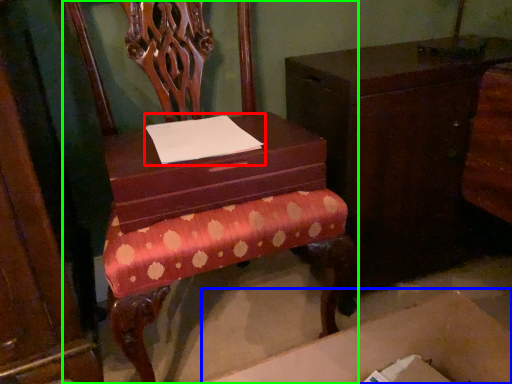
Question: Based on their relative distances, which object is farther from notepad (highlighted by a red box)? Choose from cardboard box (highlighted by a blue box) and chair (highlighted by a green box).

Choices:
 (A) cardboard box
 (B) chair

Answer: (A)